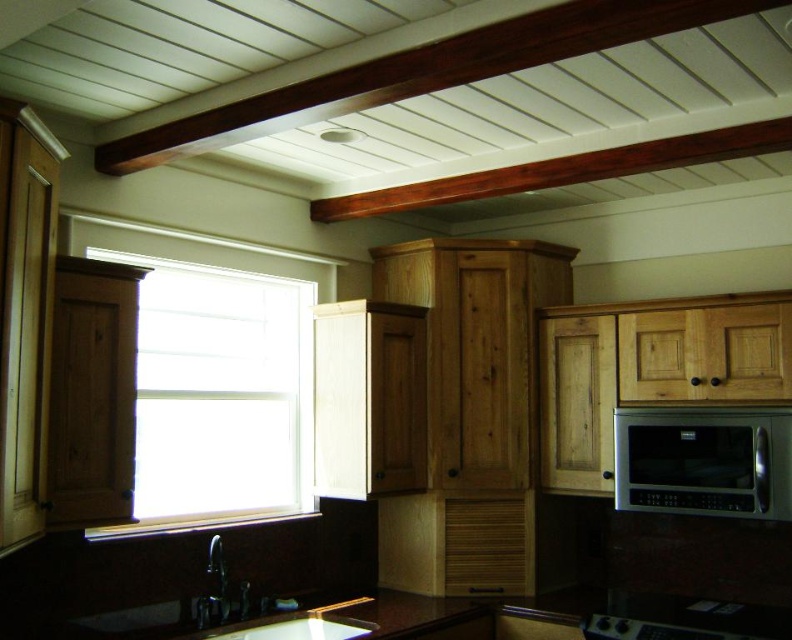
Can you confirm if white matte window at center is shorter than satin silver microwave at upper right?

No.

What are the coordinates of `white matte window at center` in the screenshot? It's located at (219, 394).

Identify the location of white matte window at center. (219, 394).

You are a GUI agent. You are given a task and a screenshot of the screen. Output one action in this format:
    pyautogui.click(x=<x>, y=<y>)
    Task: Click on the white matte window at center
    Image resolution: width=792 pixels, height=640 pixels.
    Given the screenshot: What is the action you would take?
    pyautogui.click(x=219, y=394)